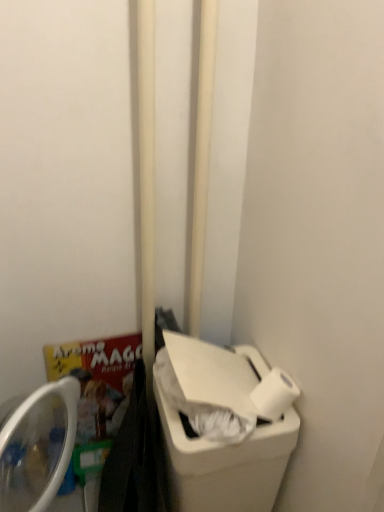
Question: From the image's perspective, relative to white smooth pole at center, marked as the second pole in a left-to-right arrangement, is white plastic recycling bin at lower right above or below?

Choices:
 (A) below
 (B) above

Answer: (A)

Question: From a real-world perspective, is white plastic recycling bin at lower right positioned above or below white smooth pole at center, marked as the second pole in a left-to-right arrangement?

Choices:
 (A) below
 (B) above

Answer: (A)

Question: Based on their relative distances, which object is nearer to the white matte toilet paper at lower right?

Choices:
 (A) white plastic recycling bin at lower right
 (B) white smooth pole at center, positioned as the second pole in right-to-left order
 (C) white smooth pole at center, marked as the second pole in a left-to-right arrangement

Answer: (A)

Question: Considering the real-world distances, which object is closest to the white smooth pole at center, the first pole in the left-to-right sequence?

Choices:
 (A) white matte toilet paper at lower right
 (B) white smooth pole at center, placed as the first pole when sorted from right to left
 (C) white plastic recycling bin at lower right

Answer: (B)